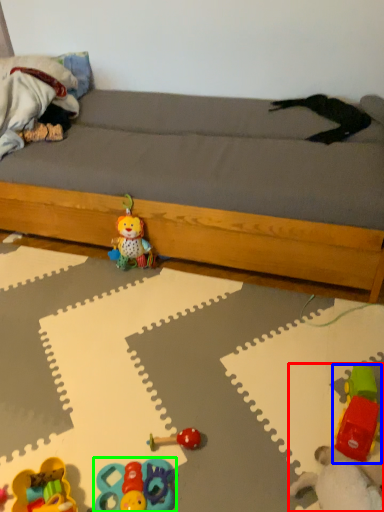
Question: Which object is positioned farthest from toy (highlighted by a red box)? Select from toy (highlighted by a blue box) and toy (highlighted by a green box).

Choices:
 (A) toy
 (B) toy

Answer: (B)